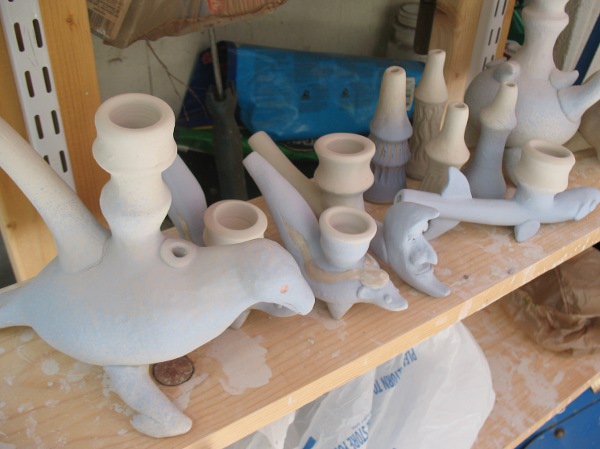
What are the coordinates of `bottom shelf` in the screenshot? It's located at (502, 366).